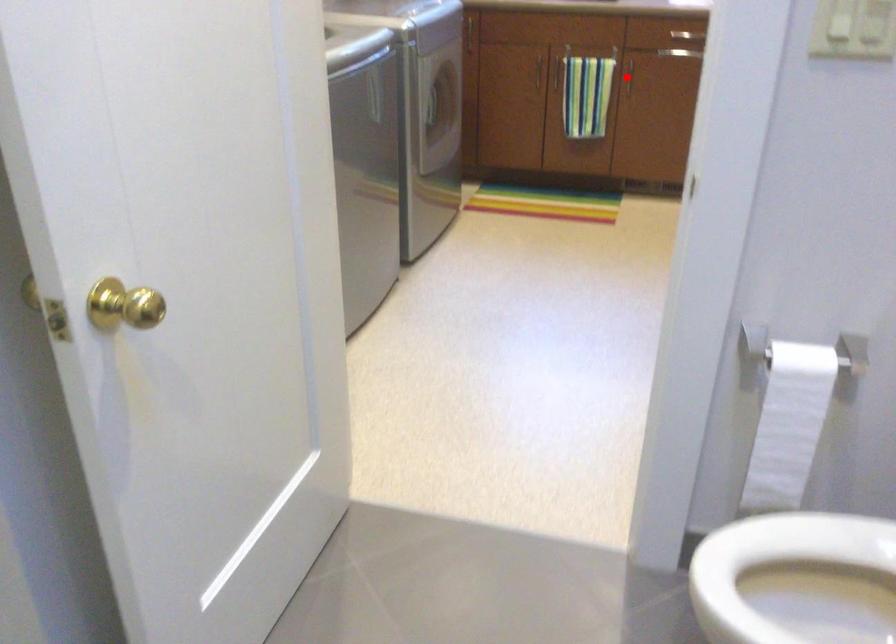
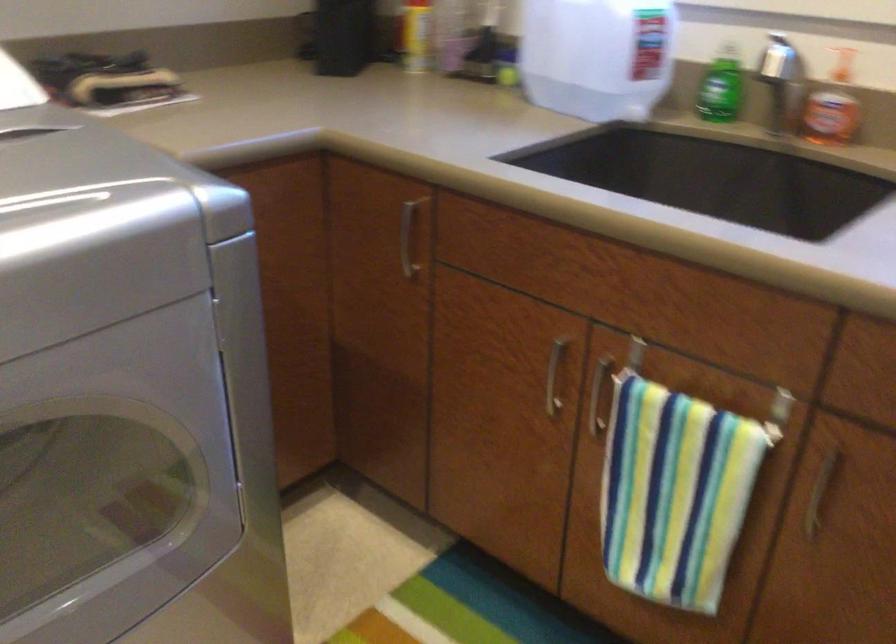
Question: I am providing you with two images of the same scene from different viewpoints. A red point is shown in image1. For the corresponding object point in image2, is it positioned nearer or farther from the camera?

Choices:
 (A) Nearer
 (B) Farther

Answer: (A)